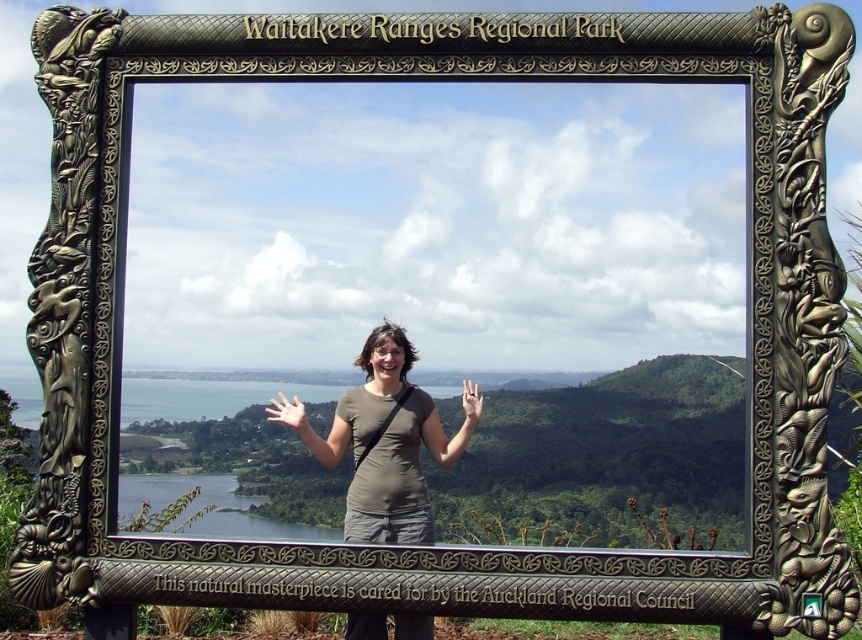
You are standing in the Waitakere Ranges Regional Park and see two points marked in the scene. The first point is at coordinate (347, 440) and the second is at (275, 413). Which point is physically closer to you?

Point (347, 440) is closer to the viewer than point (275, 413).

You are a photographer standing at the camera position. You want to take a photo of the white matte hand at center. Can you capture the hand in your photo without moving the camera?

The white matte hand at center and camera are 50.31 meters apart from each other. Since the distance is significant, the hand may appear too small in the photo unless you have a telephoto lens capable of capturing distant objects clearly.